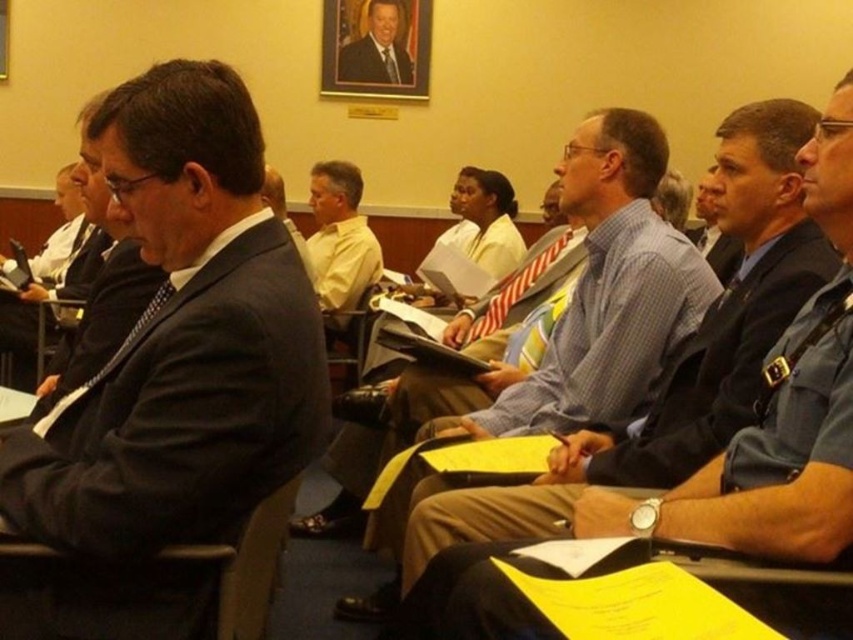
Is point (267, 582) less distant than point (380, 65)?

Yes, it is.

Is dark gray fabric chair at center thinner than smooth black suit at center?

Correct, dark gray fabric chair at center's width is less than smooth black suit at center's.

Is point (260, 602) less distant than point (386, 83)?

Yes, it is in front of point (386, 83).

This screenshot has height=640, width=853. I want to click on dark gray fabric chair at center, so point(248,564).

Which of these two, light blue checkered shirt at center or matte black suit at center, stands shorter?

matte black suit at center is shorter.

Does light blue checkered shirt at center appear on the right side of matte black suit at center?

Indeed, light blue checkered shirt at center is positioned on the right side of matte black suit at center.

Between point (672, 268) and point (308, 262), which one is positioned in front?

Point (672, 268) is in front.

In order to click on light blue checkered shirt at center in this screenshot , I will do `click(590, 296)`.

Does point (105, 182) come farther from viewer compared to point (387, 72)?

No, (105, 182) is closer to viewer.

Between matte black suit at left and smooth black suit at center, which one appears on the right side from the viewer's perspective?

Positioned to the right is smooth black suit at center.

Which is in front, point (67, 410) or point (370, 17)?

Positioned in front is point (67, 410).

What are the coordinates of `matte black suit at left` in the screenshot? It's located at (181, 340).